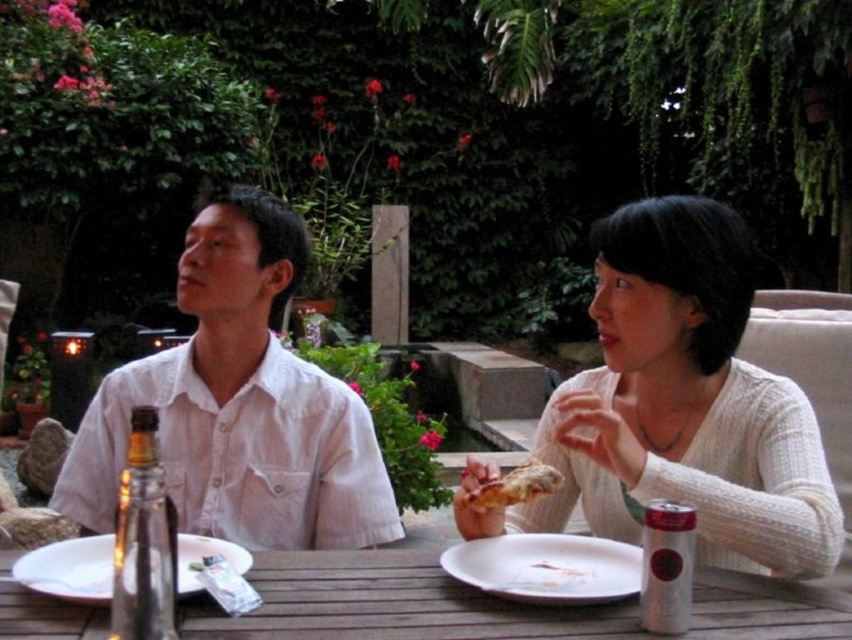
Which is behind, point (586, 522) or point (318, 422)?

Positioned behind is point (586, 522).

This screenshot has width=852, height=640. What are the coordinates of `white knitted sweater at center` in the screenshot? It's located at (678, 406).

Describe the element at coordinates (678, 406) in the screenshot. This screenshot has width=852, height=640. I see `white knitted sweater at center` at that location.

Does white knitted sweater at center have a lesser width compared to clear glass bottle at lower left?

Incorrect, white knitted sweater at center's width is not less than clear glass bottle at lower left's.

Where is `white knitted sweater at center`? white knitted sweater at center is located at coordinates (678, 406).

At what (x,y) coordinates should I click in order to perform the action: click on white knitted sweater at center. Please return your answer as a coordinate pair (x, y). The height and width of the screenshot is (640, 852). Looking at the image, I should click on pos(678,406).

From the picture: Is white linen shirt at center behind golden crispy pizza at center?

That is True.

Does white linen shirt at center appear under golden crispy pizza at center?

Incorrect, white linen shirt at center is not positioned below golden crispy pizza at center.

Find the location of a particular element. This screenshot has width=852, height=640. white linen shirt at center is located at coordinates (239, 404).